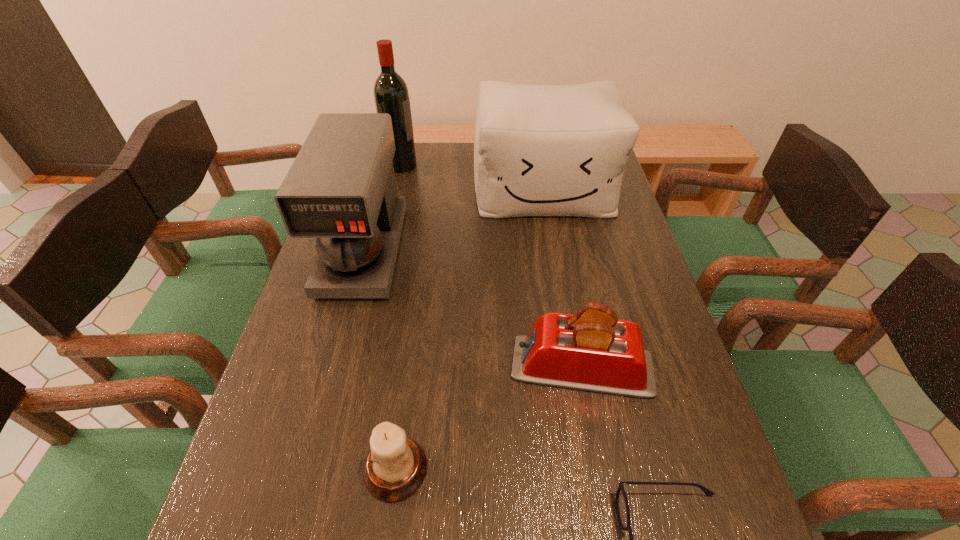
Find the location of a particular element. This screenshot has width=960, height=540. object that is the second closest to the cushion is located at coordinates (341, 189).

At what (x,y) coordinates should I click in order to perform the action: click on object that ranks as the closest to the wine bottle. Please return your answer as a coordinate pair (x, y). Image resolution: width=960 pixels, height=540 pixels. Looking at the image, I should click on (341, 189).

Find the location of a particular element. This screenshot has width=960, height=540. free space that satisfies the following two spatial constraints: 1. on the label of the tallest object; 2. on the carafe side of the coffee maker is located at coordinates (382, 250).

At what (x,y) coordinates should I click in order to perform the action: click on vacant space that satisfies the following two spatial constraints: 1. on the label of the toaster; 2. on the right side of the wine bottle. Please return your answer as a coordinate pair (x, y). Looking at the image, I should click on (355, 367).

This screenshot has height=540, width=960. Find the location of `free spot that satisfies the following two spatial constraints: 1. on the back side of the third object from left to right; 2. on the label of the wine bottle`. free spot that satisfies the following two spatial constraints: 1. on the back side of the third object from left to right; 2. on the label of the wine bottle is located at coordinates (436, 165).

The height and width of the screenshot is (540, 960). In order to click on free point that satisfies the following two spatial constraints: 1. on the label of the tallest object; 2. on the right side of the toaster in this screenshot , I will do `click(355, 367)`.

Where is `vacant space that satisfies the following two spatial constraints: 1. on the carafe side of the coffee maker; 2. on the right side of the fourth tallest object`? The height and width of the screenshot is (540, 960). vacant space that satisfies the following two spatial constraints: 1. on the carafe side of the coffee maker; 2. on the right side of the fourth tallest object is located at coordinates (332, 367).